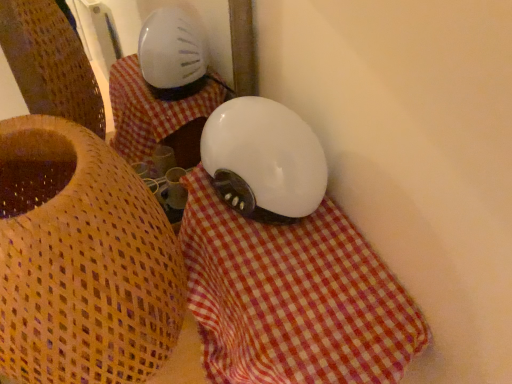
Question: From a real-world perspective, is white glossy helmet at center physically above white checkered cloth at center?

Choices:
 (A) no
 (B) yes

Answer: (B)

Question: Considering the relative positions of white glossy helmet at center and white checkered cloth at center in the image provided, is white glossy helmet at center behind white checkered cloth at center?

Choices:
 (A) no
 (B) yes

Answer: (B)

Question: From a real-world perspective, is white glossy helmet at center positioned under white checkered cloth at center based on gravity?

Choices:
 (A) yes
 (B) no

Answer: (B)

Question: Is white glossy helmet at center touching white checkered cloth at center?

Choices:
 (A) yes
 (B) no

Answer: (B)

Question: From the image's perspective, is white glossy helmet at center under white checkered cloth at center?

Choices:
 (A) no
 (B) yes

Answer: (A)

Question: Could you tell me if white glossy helmet at center is facing white checkered cloth at center?

Choices:
 (A) yes
 (B) no

Answer: (B)

Question: Is matte white lampshade at upper center closer to camera compared to white glossy helmet at center?

Choices:
 (A) yes
 (B) no

Answer: (A)

Question: From a real-world perspective, is matte white lampshade at upper center on white glossy helmet at center?

Choices:
 (A) yes
 (B) no

Answer: (B)

Question: Is matte white lampshade at upper center touching white glossy helmet at center?

Choices:
 (A) yes
 (B) no

Answer: (B)

Question: Is the depth of matte white lampshade at upper center greater than that of white glossy helmet at center?

Choices:
 (A) yes
 (B) no

Answer: (B)

Question: Is matte white lampshade at upper center far away from white glossy helmet at center?

Choices:
 (A) no
 (B) yes

Answer: (A)

Question: Could you tell me if matte white lampshade at upper center is facing white glossy helmet at center?

Choices:
 (A) yes
 (B) no

Answer: (B)

Question: From a real-world perspective, is white checkered cloth at center on top of white glossy helmet at center?

Choices:
 (A) no
 (B) yes

Answer: (A)